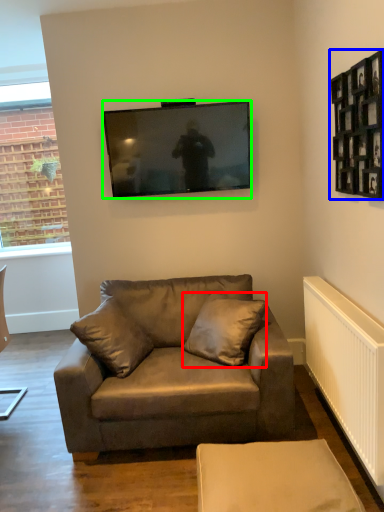
Question: Which object is positioned closest to pillow (highlighted by a red box)? Select from picture frame (highlighted by a blue box) and television (highlighted by a green box).

Choices:
 (A) picture frame
 (B) television

Answer: (B)